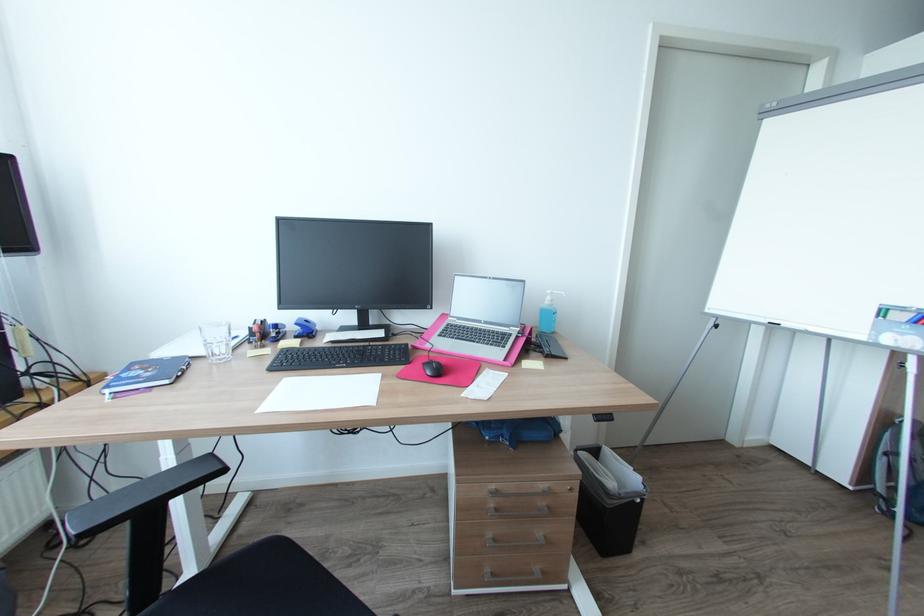
Find where to sit the chair sitting surface. Please return your answer as a coordinate pair (x, y).

(210, 557)